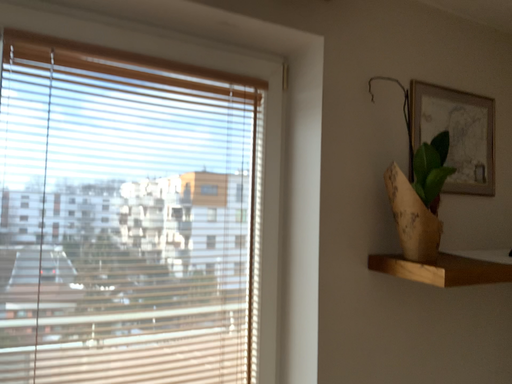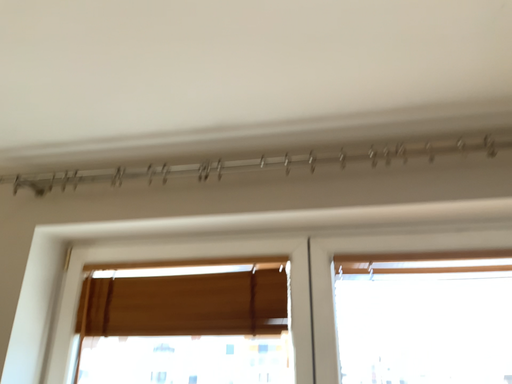
Question: How did the camera likely rotate when shooting the video?

Choices:
 (A) rotated left
 (B) rotated right

Answer: (A)